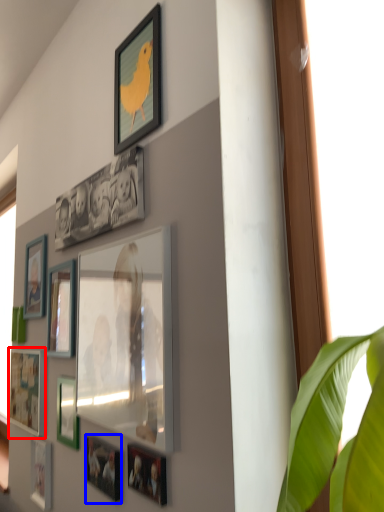
Question: Which object is closer to the camera taking this photo, picture frame (highlighted by a red box) or picture frame (highlighted by a blue box)?

Choices:
 (A) picture frame
 (B) picture frame

Answer: (B)